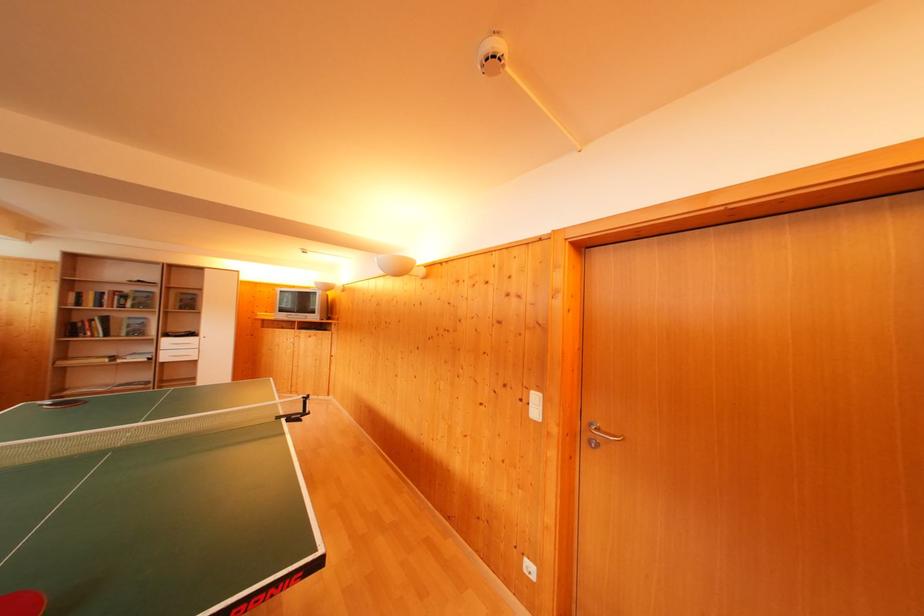
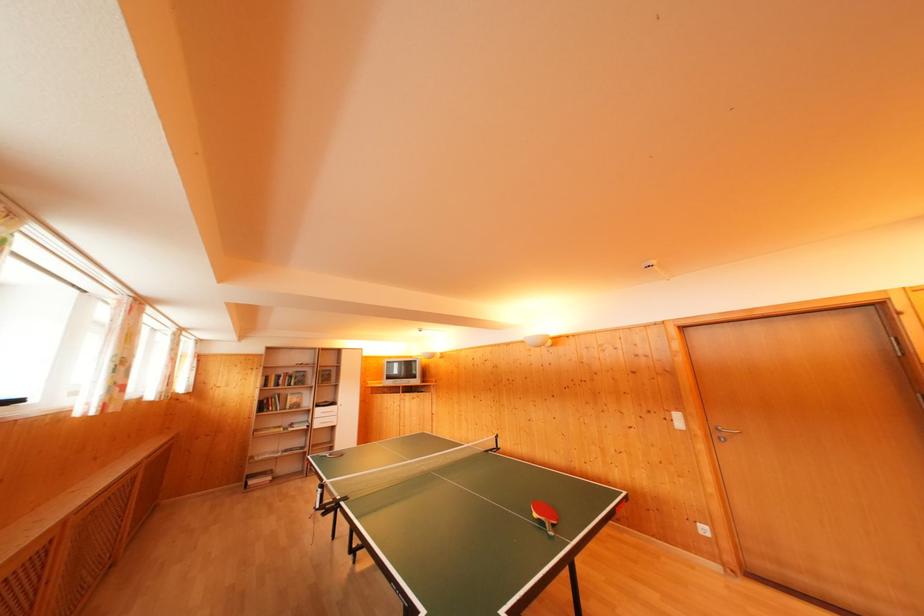
Locate, in the second image, the point that corresponds to point (535, 573) in the first image.

(709, 535)